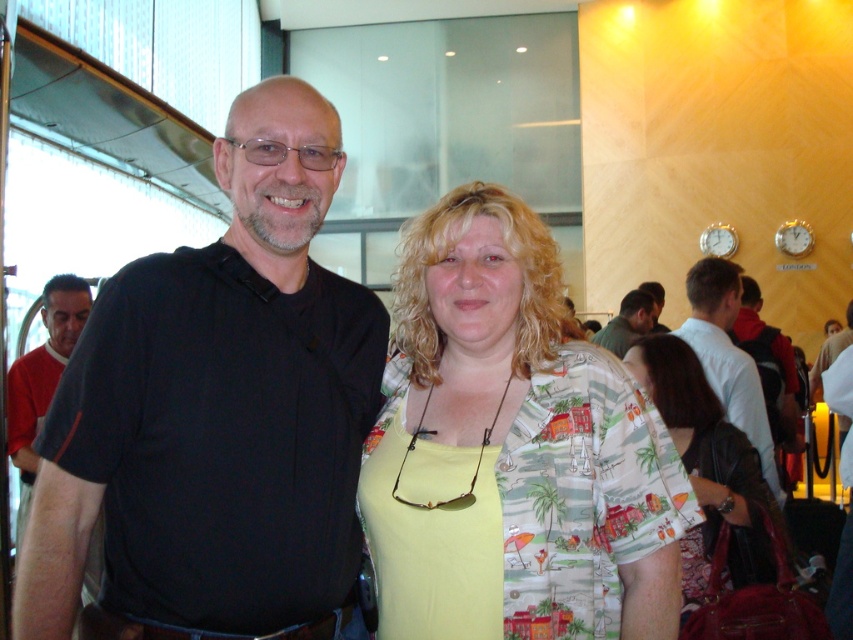
You are a photographer trying to capture a candid shot of the black polo shirt at center and the dark brown hair at center. Since you want to ensure both subjects are fully visible in the frame, which subject should you focus on to avoid cropping the taller one?

The black polo shirt at center is taller than dark brown hair at center, so you should focus on the black polo shirt at center to avoid cropping the taller one.